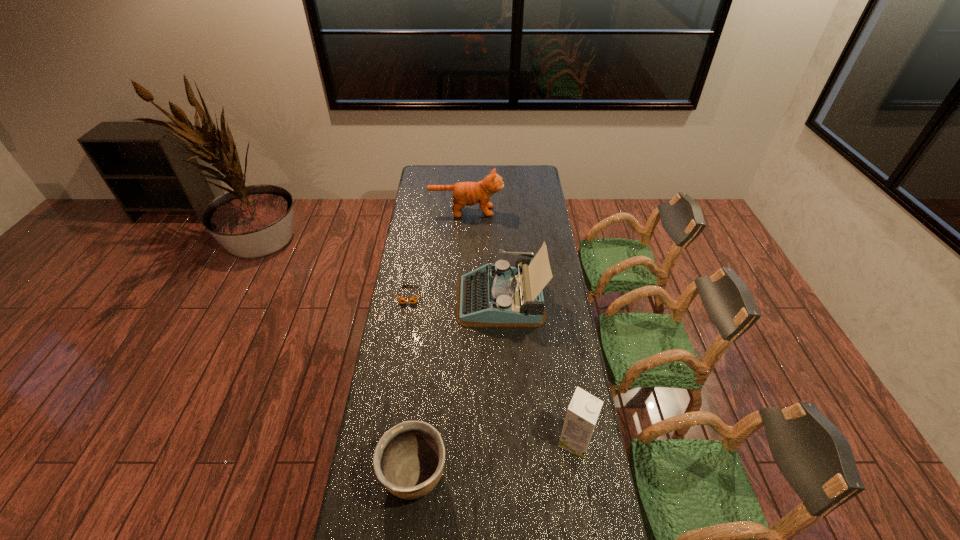
Where is `vacant region at the far left corner`? This screenshot has height=540, width=960. vacant region at the far left corner is located at coordinates (419, 179).

Identify the location of blank area at the far right corner. The image size is (960, 540). (538, 171).

Identify the location of unoccupied position between the carton and the typewriter. This screenshot has width=960, height=540. (538, 370).

You are a GUI agent. You are given a task and a screenshot of the screen. Output one action in this format:
    pyautogui.click(x=<x>, y=<y>)
    Task: Click on the empty space that is in between the carton and the goggles
    The height and width of the screenshot is (540, 960).
    Given the screenshot: What is the action you would take?
    pyautogui.click(x=492, y=368)

Where is `empty location between the typewriter and the goggles`? This screenshot has height=540, width=960. empty location between the typewriter and the goggles is located at coordinates (455, 297).

Find the location of `free space between the typewriter and the carton`. free space between the typewriter and the carton is located at coordinates (538, 370).

The width and height of the screenshot is (960, 540). I want to click on vacant region between the fourth tallest object and the shortest object, so click(x=412, y=386).

At what (x,y) coordinates should I click in order to perform the action: click on vacant area that lies between the typewriter and the pottery. Please return your answer as a coordinate pair (x, y). The width and height of the screenshot is (960, 540). Looking at the image, I should click on (458, 387).

Find the location of a particular element. free space between the shortest object and the farthest object is located at coordinates (438, 253).

Find the location of `free space that is in between the typewriter and the carton`. free space that is in between the typewriter and the carton is located at coordinates (538, 370).